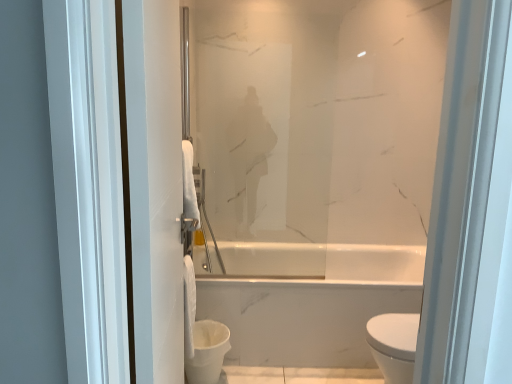
Describe the element at coordinates (318, 135) in the screenshot. I see `satin glass mirror at center` at that location.

Measure the distance between point (185, 289) and camera.

A distance of 7.69 feet exists between point (185, 289) and camera.

Locate an element on the screen. This screenshot has width=512, height=384. satin glass mirror at center is located at coordinates coord(318,135).

Do you think white matte towel at left is within white glossy toilet bowl at lower center, or outside of it?

white matte towel at left is located beyond the bounds of white glossy toilet bowl at lower center.

From the image's perspective, who appears lower, white matte towel at left or white glossy toilet bowl at lower center?

white glossy toilet bowl at lower center is shown below in the image.

Find the location of a particular element. toilet bowl directly beneath the white matte towel at left (from a real-world perspective) is located at coordinates (207, 352).

Is white matte towel at left oriented towards white glossy toilet bowl at lower center?

No, white matte towel at left is not facing towards white glossy toilet bowl at lower center.

Where is `screen door in front of the satin glass mirror at center`? The height and width of the screenshot is (384, 512). screen door in front of the satin glass mirror at center is located at coordinates (163, 191).

Can you confirm if white matte towel at left is positioned to the right of satin glass mirror at center?

Incorrect, white matte towel at left is not on the right side of satin glass mirror at center.

Looking at this image, is white matte towel at left bigger or smaller than satin glass mirror at center?

white matte towel at left is bigger than satin glass mirror at center.

Is white matte towel at left positioned with its back to satin glass mirror at center?

That's not correct — white matte towel at left is not looking away from satin glass mirror at center.

From the image's perspective, is white matte towel at left above white fluffy toilet paper at center?

Yes, from the image's perspective, white matte towel at left is on top of white fluffy toilet paper at center.

Looking at this image, is white fluffy toilet paper at center located within white matte towel at left?

No, white matte towel at left does not contain white fluffy toilet paper at center.

Could you tell me if white matte towel at left is facing white fluffy toilet paper at center?

No.

Between white matte towel at left and white fluffy toilet paper at center, which one has less height?

Standing shorter between the two is white fluffy toilet paper at center.

Can you confirm if satin glass mirror at center is positioned to the right of white matte towel at left?

Indeed, satin glass mirror at center is positioned on the right side of white matte towel at left.

Between satin glass mirror at center and white matte towel at left, which one has less height?

With less height is satin glass mirror at center.

Is satin glass mirror at center in front of white matte towel at left?

No, satin glass mirror at center is further to the viewer.

Which object is thinner, satin glass mirror at center or white matte towel at left?

With smaller width is satin glass mirror at center.

Considering the relative sizes of white fluffy toilet paper at center and white glossy toilet bowl at lower center in the image provided, is white fluffy toilet paper at center smaller than white glossy toilet bowl at lower center?

Indeed, white fluffy toilet paper at center has a smaller size compared to white glossy toilet bowl at lower center.

How distant is white fluffy toilet paper at center from white glossy toilet bowl at lower center?

white fluffy toilet paper at center and white glossy toilet bowl at lower center are 4.98 inches apart from each other.

Can you confirm if white fluffy toilet paper at center is taller than white glossy toilet bowl at lower center?

Indeed, white fluffy toilet paper at center has a greater height compared to white glossy toilet bowl at lower center.

Is white fluffy toilet paper at center not within white glossy toilet bowl at lower center?

Yes, white fluffy toilet paper at center is located beyond the bounds of white glossy toilet bowl at lower center.

Which object is more forward, white glossy toilet bowl at lower center or white matte towel at left?

white matte towel at left is more forward.

Is white glossy toilet bowl at lower center placed right next to white matte towel at left?

white glossy toilet bowl at lower center and white matte towel at left are not in contact.

Is white glossy toilet bowl at lower center positioned with its back to white matte towel at left?

No.

Is white fluffy toilet paper at center located outside satin glass mirror at center?

Yes, white fluffy toilet paper at center is not within satin glass mirror at center.

Who is taller, white fluffy toilet paper at center or satin glass mirror at center?

With more height is satin glass mirror at center.

In the scene shown: Which is closer to the camera, (189, 293) or (359, 78)?

Point (189, 293).

Is white fluffy toilet paper at center positioned before satin glass mirror at center?

Yes, the depth of white fluffy toilet paper at center is less than that of satin glass mirror at center.

This screenshot has height=384, width=512. I want to click on screen door on the left side of white glossy toilet bowl at lower center, so click(163, 191).

The height and width of the screenshot is (384, 512). I want to click on screen door below the satin glass mirror at center (from a real-world perspective), so click(163, 191).

Considering their positions, is white glossy toilet bowl at lower center positioned closer to white matte towel at left than white fluffy toilet paper at center?

white glossy toilet bowl at lower center.

Estimate the real-world distances between objects in this image. Which object is further from white fluffy toilet paper at center, satin glass mirror at center or white glossy toilet bowl at lower center?

Based on the image, satin glass mirror at center appears to be further to white fluffy toilet paper at center.

Looking at the image, which one is located further to white glossy toilet bowl at lower center, white fluffy toilet paper at center or satin glass mirror at center?

satin glass mirror at center is further to white glossy toilet bowl at lower center.

Considering their positions, is white matte towel at left positioned closer to satin glass mirror at center than white glossy toilet bowl at lower center?

white matte towel at left.

Looking at the image, which one is located closer to white matte towel at left, white glossy toilet bowl at lower center or satin glass mirror at center?

white glossy toilet bowl at lower center is positioned closer to the anchor white matte towel at left.

Which object lies nearer to the anchor point white glossy toilet bowl at lower center, white matte towel at left or white fluffy toilet paper at center?

Based on the image, white fluffy toilet paper at center appears to be nearer to white glossy toilet bowl at lower center.

Considering their positions, is satin glass mirror at center positioned closer to white fluffy toilet paper at center than white matte towel at left?

The object closer to white fluffy toilet paper at center is white matte towel at left.

Based on their spatial positions, is white matte towel at left or satin glass mirror at center further from white glossy toilet bowl at lower center?

Among the two, satin glass mirror at center is located further to white glossy toilet bowl at lower center.

Where is `toilet paper between satin glass mirror at center and white glossy toilet bowl at lower center in the vertical direction`? This screenshot has height=384, width=512. toilet paper between satin glass mirror at center and white glossy toilet bowl at lower center in the vertical direction is located at coordinates (189, 305).

In order to click on toilet bowl between white matte towel at left and satin glass mirror at center along the z-axis in this screenshot , I will do `click(207, 352)`.

Where is `toilet paper positioned between white matte towel at left and white glossy toilet bowl at lower center from near to far`? The image size is (512, 384). toilet paper positioned between white matte towel at left and white glossy toilet bowl at lower center from near to far is located at coordinates (189, 305).

Locate an element on the screen. toilet paper positioned between white matte towel at left and satin glass mirror at center from near to far is located at coordinates (189, 305).